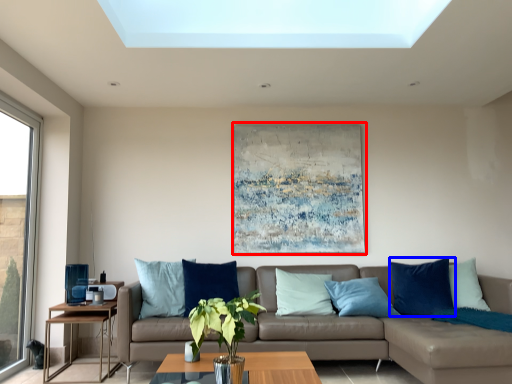
Question: Which point is closer to the camera, picture frame (highlighted by a red box) or pillow (highlighted by a blue box)?

Choices:
 (A) picture frame
 (B) pillow

Answer: (B)